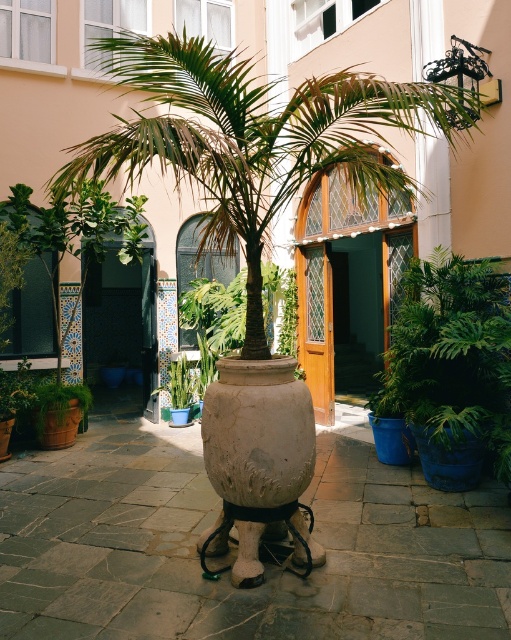
Question: Does green leafy palm tree at center have a greater width compared to white textured vase at center?

Choices:
 (A) no
 (B) yes

Answer: (B)

Question: Does green leafy palm tree at center appear under white textured vase at center?

Choices:
 (A) yes
 (B) no

Answer: (B)

Question: Which object appears farthest from the camera in this image?

Choices:
 (A) white textured vase at center
 (B) green leafy palm tree at center

Answer: (A)

Question: Does green leafy palm tree at center appear on the left side of white textured vase at center?

Choices:
 (A) yes
 (B) no

Answer: (B)